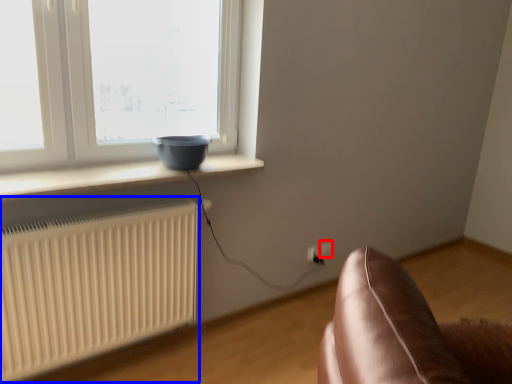
Question: Which of the following is the closest to the observer, electric outlet (highlighted by a red box) or radiator (highlighted by a blue box)?

Choices:
 (A) electric outlet
 (B) radiator

Answer: (B)